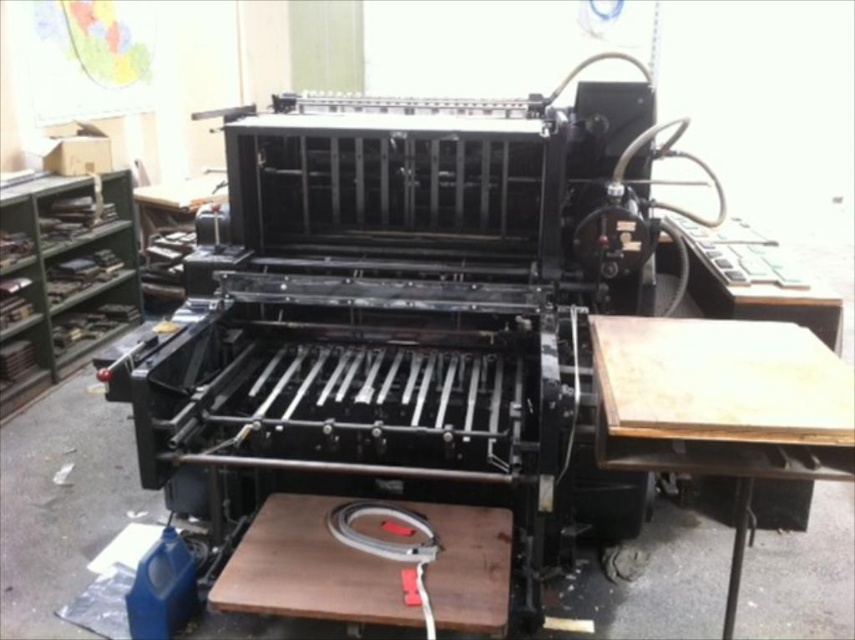
You are an employee in the printing facility and need to place a new ink cartridge on the wooden table at right and the brown wooden table at center. Which table is located to the right side of the other?

The wooden table at right is positioned on the right side of brown wooden table at center, so the wooden table at right is to the right of the brown wooden table at center.

You are an engineer standing at the back of the industrial printing press. You need to locate two specific points for maintenance. The first point is at coordinates point (738, 364), and the second point is at point (482, 556). From your current position, which point is closer to you?

Point (738, 364) is in front of point (482, 556), so the point closer to you is point (738, 364).

You are standing in front of the industrial printing press and need to place a tool exactly at the point labeled point (721, 406). Based on the scene description, where should you place the tool?

The point (721, 406) is on the wooden table at right, so you should place the tool on the wooden table at right.